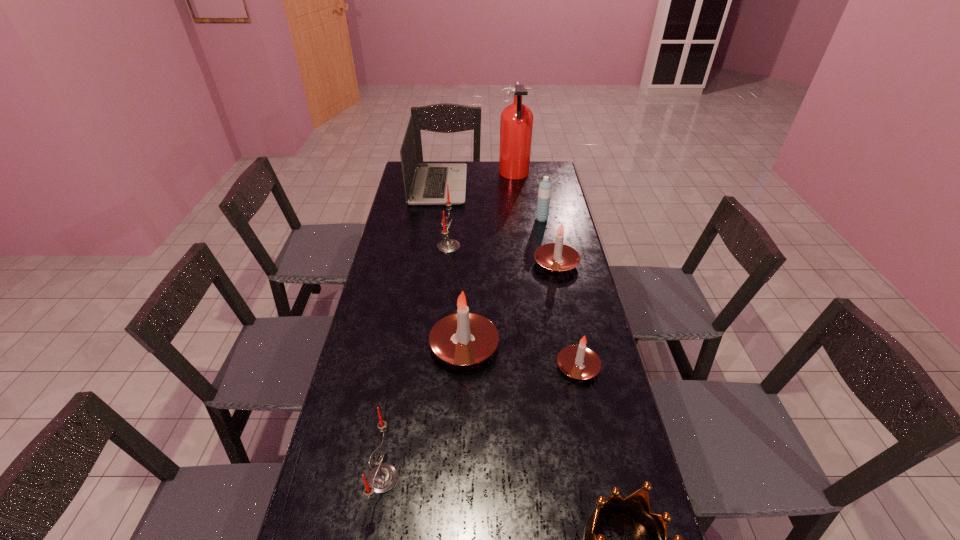
At what (x,y) coordinates should I click in order to perform the action: click on fire extinguisher that is at the far edge. Please return your answer as a coordinate pair (x, y). The width and height of the screenshot is (960, 540). Looking at the image, I should click on (516, 124).

Find the location of a particular element. The height and width of the screenshot is (540, 960). laptop computer at the far edge is located at coordinates (429, 185).

Locate an element on the screen. Image resolution: width=960 pixels, height=540 pixels. laptop computer present at the left edge is located at coordinates (429, 185).

At what (x,y) coordinates should I click in order to perform the action: click on candle at the left edge. Please return your answer as a coordinate pair (x, y). This screenshot has width=960, height=540. Looking at the image, I should click on (382, 478).

Identify the location of fire extinguisher located at the right edge. This screenshot has height=540, width=960. (516, 124).

At what (x,y) coordinates should I click in order to perform the action: click on water bottle that is at the right edge. Please return your answer as a coordinate pair (x, y). This screenshot has width=960, height=540. Looking at the image, I should click on (544, 193).

This screenshot has width=960, height=540. In order to click on object situated at the far left corner in this screenshot , I will do `click(429, 185)`.

Identify the location of object that is at the far right corner. (516, 124).

Identify the location of free point at the far edge. (511, 185).

Locate an element on the screen. The width and height of the screenshot is (960, 540). free space at the left edge is located at coordinates (395, 360).